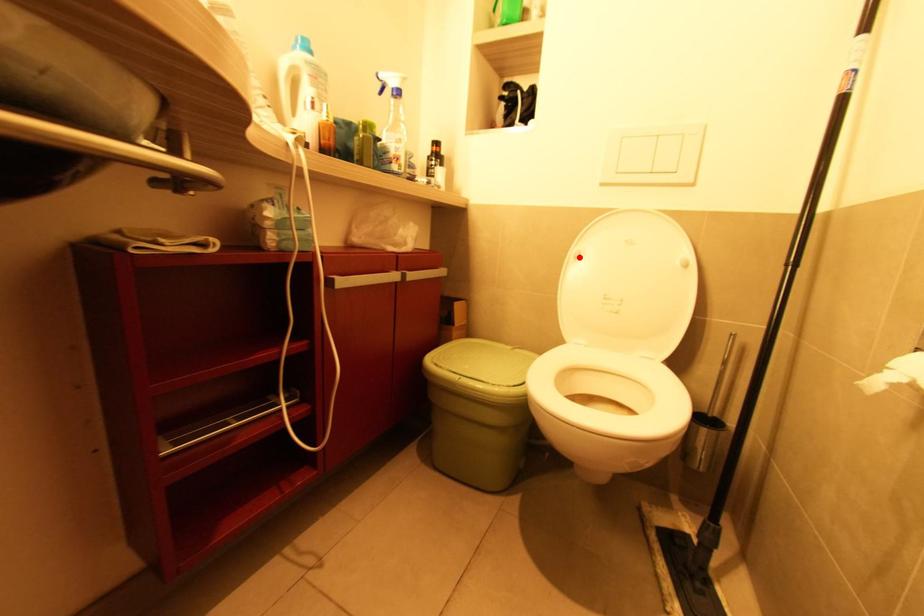
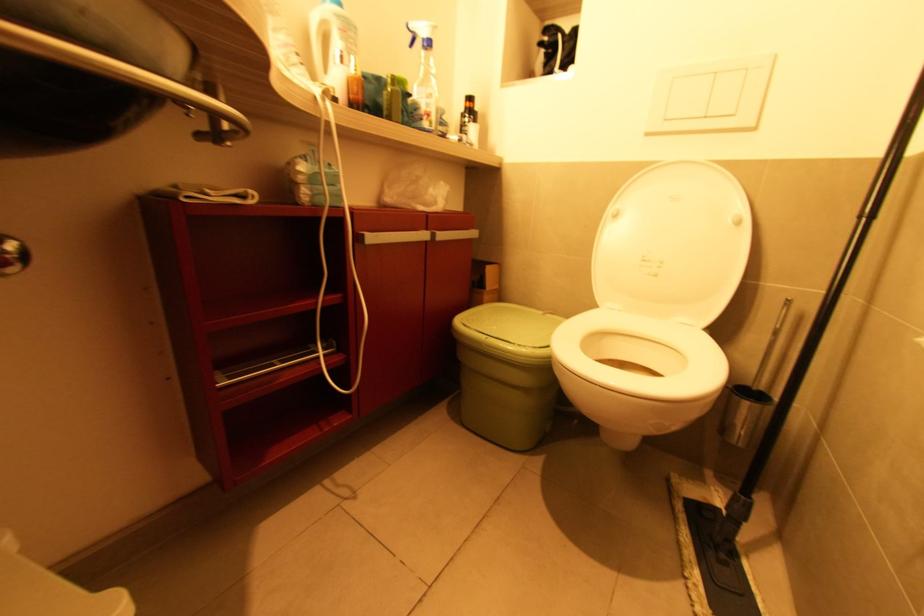
Locate, in the second image, the point that corresponds to the highlighted location in the first image.

(617, 217)